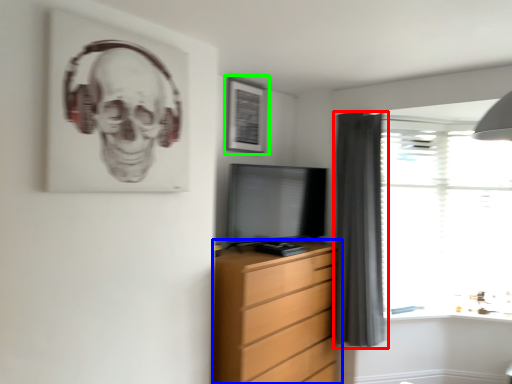
Question: Estimate the real-world distances between objects in this image. Which object is farther from curtain (highlighted by a red box), chest of drawers (highlighted by a blue box) or picture frame (highlighted by a green box)?

Choices:
 (A) chest of drawers
 (B) picture frame

Answer: (B)